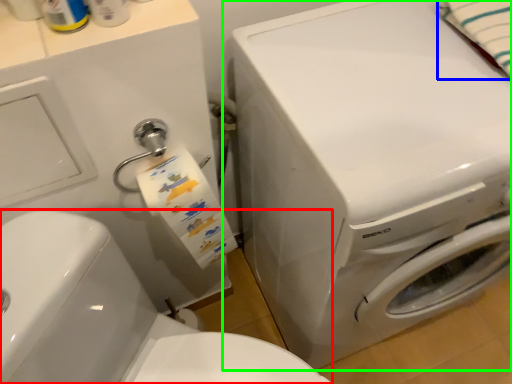
Question: Estimate the real-world distances between objects in this image. Which object is farther from washer (highlighted by a red box), bath towel (highlighted by a blue box) or washing machine (highlighted by a green box)?

Choices:
 (A) bath towel
 (B) washing machine

Answer: (A)